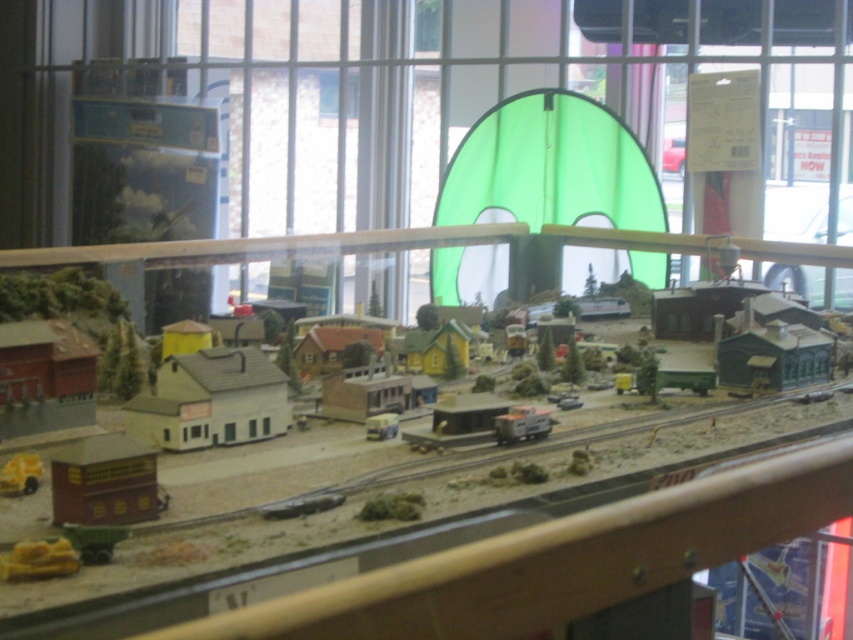
Can you confirm if matte red building at left is smaller than wooden grain train car at lower left?

Actually, matte red building at left might be larger than wooden grain train car at lower left.

Is point (33, 419) more distant than point (138, 451)?

Yes, it is.

The image size is (853, 640). In order to click on matte red building at left in this screenshot , I will do `click(45, 378)`.

Does metallic silver trailer at center appear on the right side of metallic silver train car at center?

Correct, you'll find metallic silver trailer at center to the right of metallic silver train car at center.

Does metallic silver trailer at center appear over metallic silver train car at center?

Indeed, metallic silver trailer at center is positioned over metallic silver train car at center.

Who is more forward, (503, 442) or (389, 436)?

Point (503, 442) is more forward.

In order to click on metallic silver trailer at center in this screenshot , I will do `click(521, 424)`.

Does metallic silver trailer at center appear on the left side of metallic yellow train car at lower left?

In fact, metallic silver trailer at center is to the right of metallic yellow train car at lower left.

Which is behind, point (514, 435) or point (20, 465)?

Positioned behind is point (514, 435).

Which is behind, point (518, 410) or point (24, 488)?

The point (518, 410) is behind.

In order to click on metallic silver trailer at center in this screenshot , I will do `click(521, 424)`.